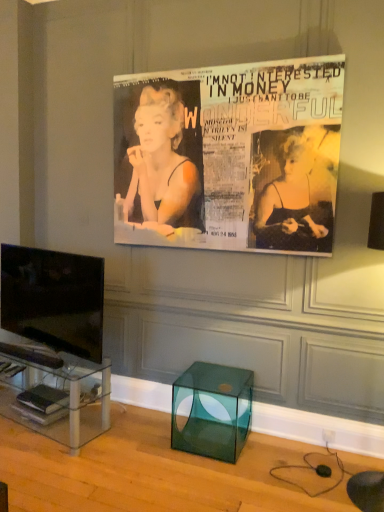
Identify the location of free space to the left of transparent glass cube at lower center. (147, 460).